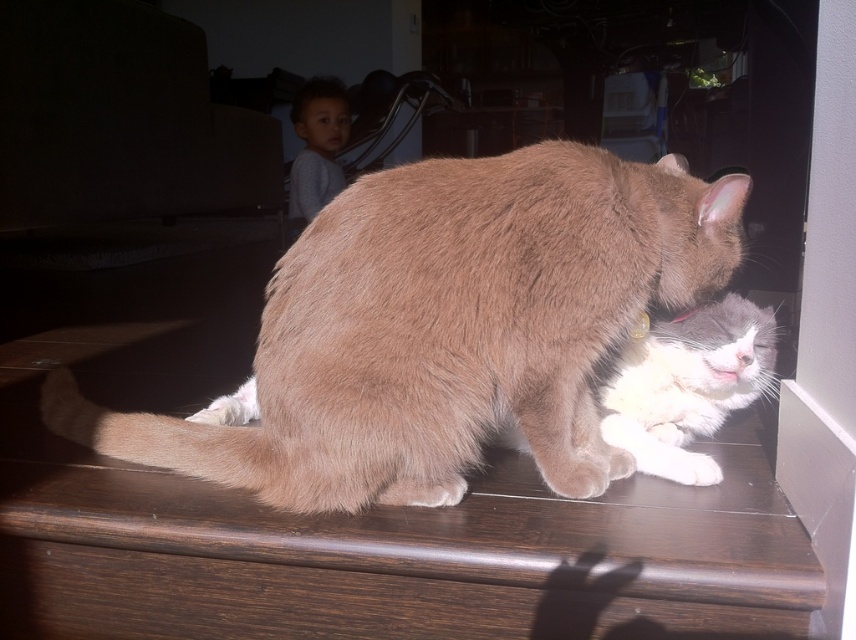
Question: Can you confirm if light brown fur cat at center is smaller than white fluffy cat at lower right?

Choices:
 (A) yes
 (B) no

Answer: (B)

Question: Which object appears farthest from the camera in this image?

Choices:
 (A) light brown fur cat at center
 (B) white fluffy cat at lower right

Answer: (B)

Question: Which object is farther from the camera taking this photo?

Choices:
 (A) light brown fur cat at center
 (B) white fluffy cat at lower right

Answer: (B)

Question: Does light brown fur cat at center have a larger size compared to white fluffy cat at lower right?

Choices:
 (A) no
 (B) yes

Answer: (B)

Question: Considering the relative positions of light brown fur cat at center and white fluffy cat at lower right in the image provided, where is light brown fur cat at center located with respect to white fluffy cat at lower right?

Choices:
 (A) right
 (B) left

Answer: (B)

Question: Which point appears farthest from the camera in this image?

Choices:
 (A) (684, 381)
 (B) (307, 276)

Answer: (A)